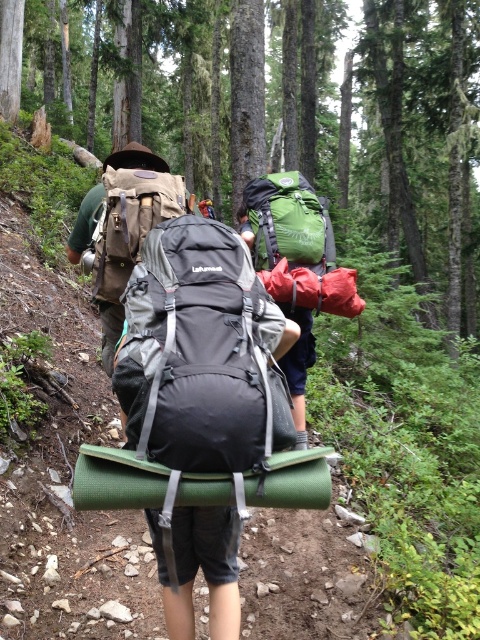
Question: Among these points, which one is nearest to the camera?

Choices:
 (A) (295, 250)
 (B) (132, 182)

Answer: (B)

Question: Does black matte backpack at center appear on the right side of green fabric backpack at center?

Choices:
 (A) yes
 (B) no

Answer: (B)

Question: Is the position of green fabric backpack at center more distant than that of matte brown backpack at center?

Choices:
 (A) yes
 (B) no

Answer: (A)

Question: Observing the image, what is the correct spatial positioning of green fabric backpack at center in reference to matte brown backpack at center?

Choices:
 (A) right
 (B) left

Answer: (A)

Question: Among these points, which one is nearest to the camera?

Choices:
 (A) (151, 221)
 (B) (279, 193)
 (C) (132, 400)

Answer: (C)

Question: Which point is closer to the camera taking this photo?

Choices:
 (A) (156, 360)
 (B) (116, 280)
 (C) (328, 275)

Answer: (A)